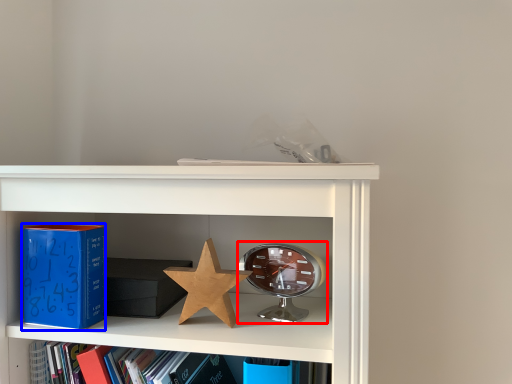
Question: Which object is further to the camera taking this photo, alarm clock (highlighted by a red box) or paperback book (highlighted by a blue box)?

Choices:
 (A) alarm clock
 (B) paperback book

Answer: (A)